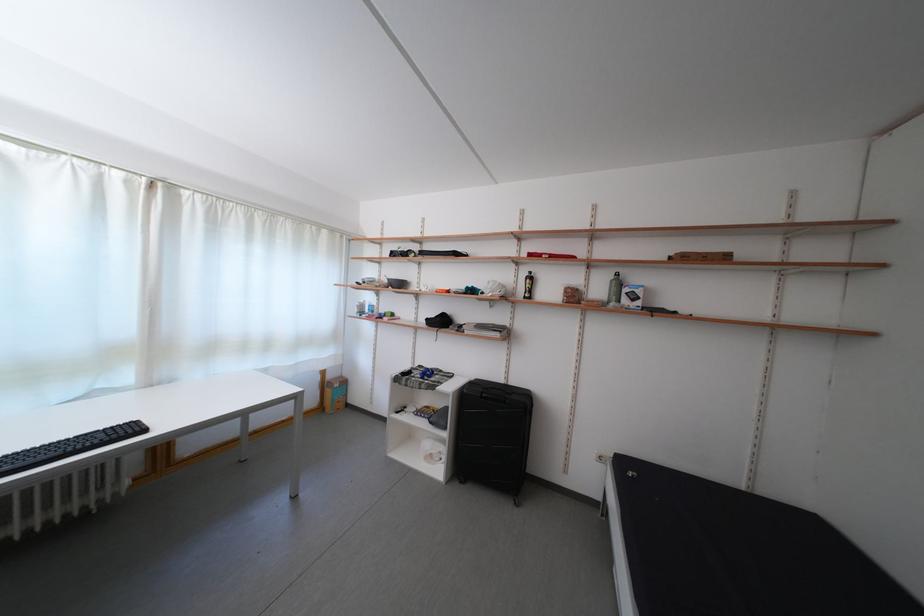
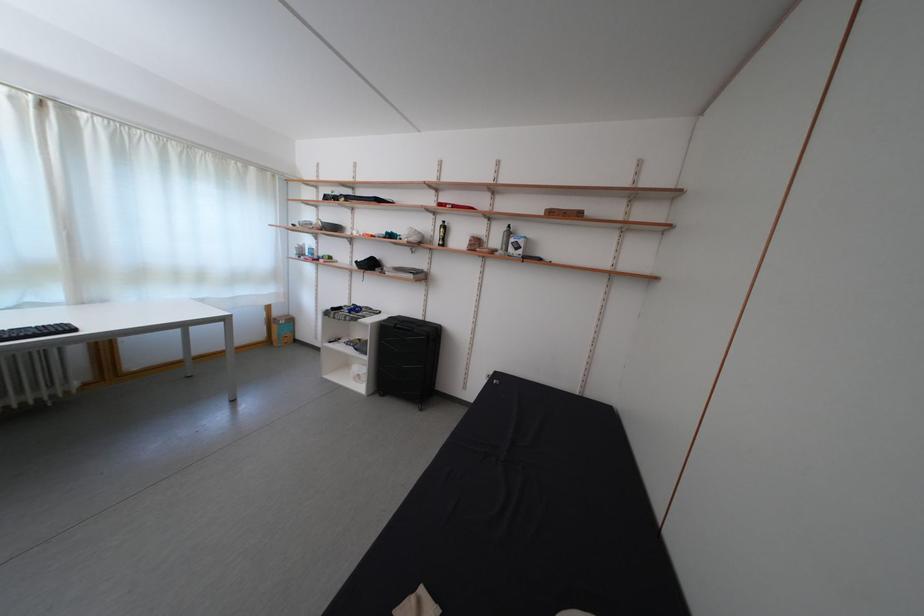
In the second image, find the point that corresponds to (608,296) in the first image.

(505, 246)